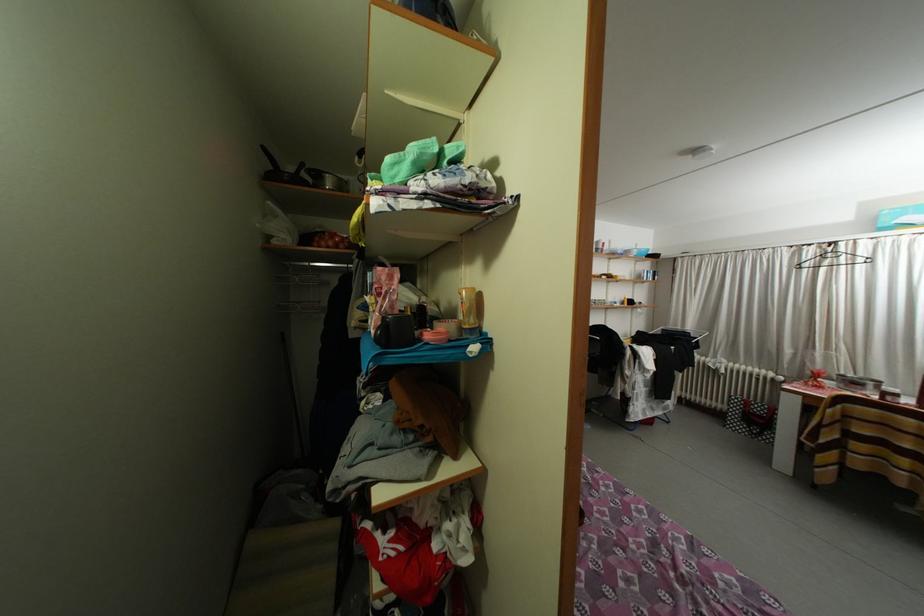
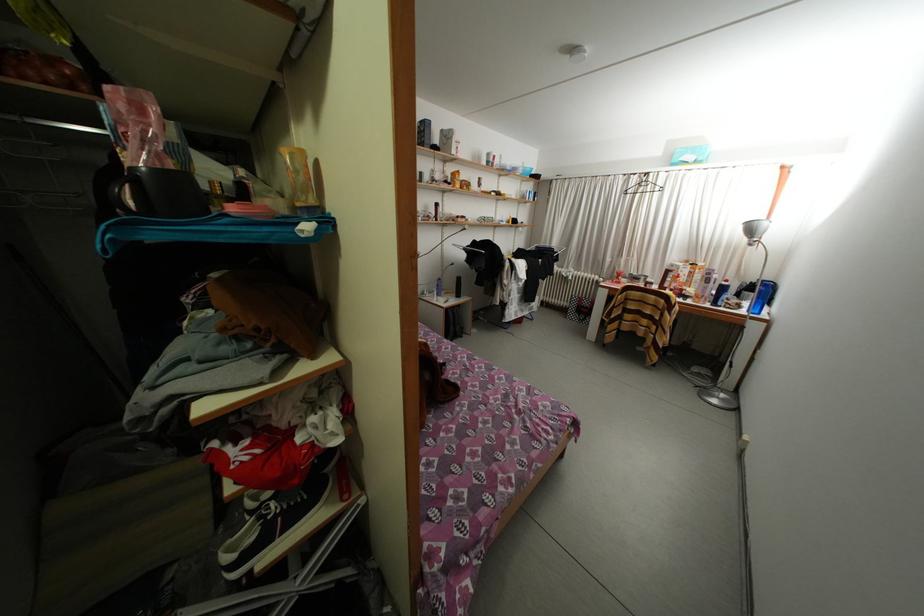
The images are taken continuously from a first-person perspective. In which direction is your viewpoint rotating?

The camera's rotation is toward right-down.